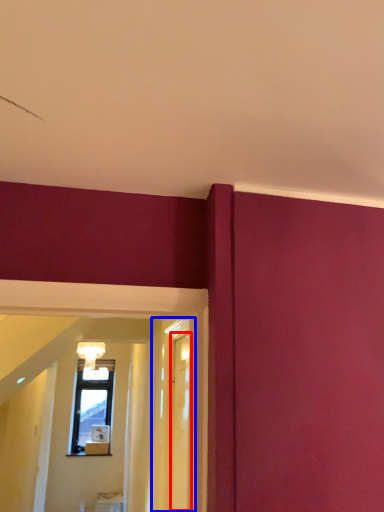
Question: Which object appears farthest to the camera in this image, glass door (highlighted by a red box) or glass door (highlighted by a blue box)?

Choices:
 (A) glass door
 (B) glass door

Answer: (A)